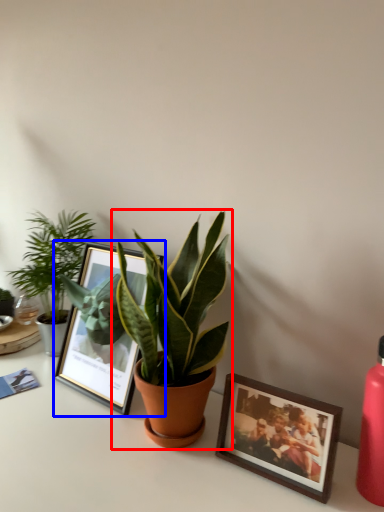
Question: Which object appears farthest to the camera in this image, houseplant (highlighted by a red box) or picture frame (highlighted by a blue box)?

Choices:
 (A) houseplant
 (B) picture frame

Answer: (B)